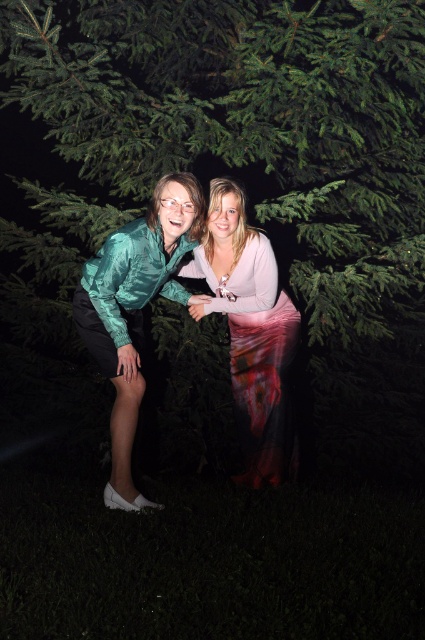
You are a photographer setting up for a group photo. The subjects are wearing a shiny teal blouse at left and have blonde hair at center. You need to ensure there is enough space between them for a natural pose. The minimum required distance for the pose is 18 inches. Can they maintain the required spacing?

The shiny teal blouse at left and blonde hair at center are 18.12 inches apart from each other, which meets the minimum required distance of 18 inches for the pose. They can maintain the required spacing.